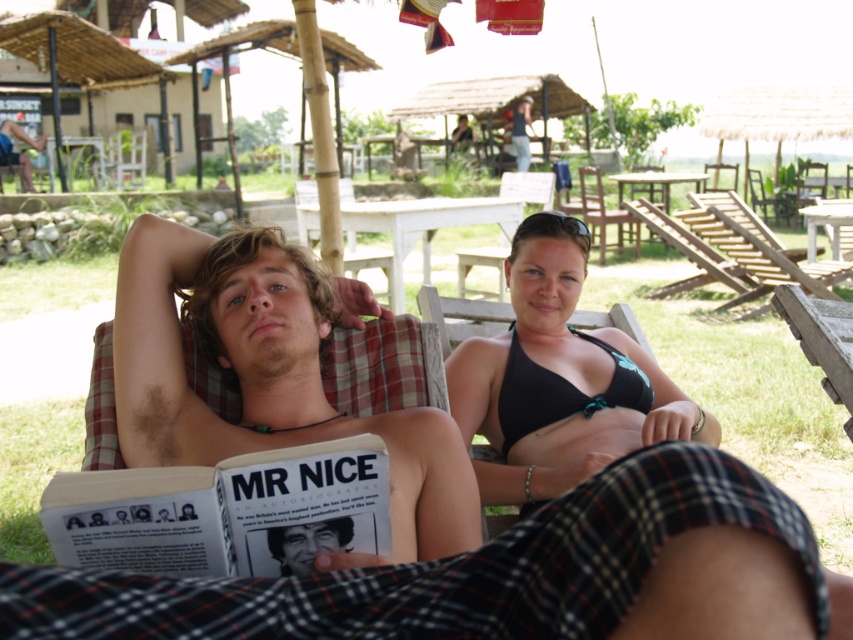
You are standing in the outdoor area with two sunbeds. There is a point marked at coordinates point [515,252]. If you want to place a 5 feet long umbrella pole at this point, will it be tall enough to provide shade for both people on the sunbeds?

The distance of point [515,252] from viewer is 7.81 feet. Since the umbrella pole is only 5 feet long, it will not be tall enough to provide shade for both people on the sunbeds.

You are standing in the outdoor area and want to take a photo of both the point at coordinates point [320,392] and point [596,216]. Which point should you focus on first to ensure both are in focus?

You should focus on the point at coordinates point [320,392] first because it is closer to the camera than point [596,216], ensuring both points are within the depth of field.